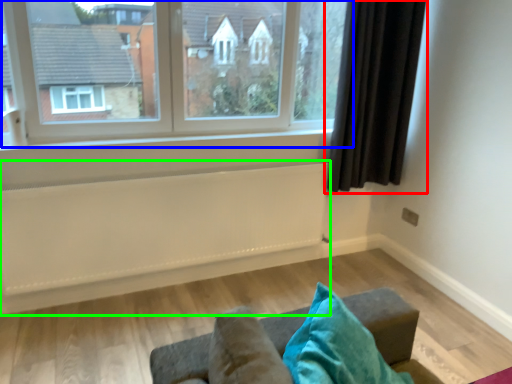
Question: Based on their relative distances, which object is nearer to curtain (highlighted by a red box)? Choose from window (highlighted by a blue box) and radiator (highlighted by a green box).

Choices:
 (A) window
 (B) radiator

Answer: (A)